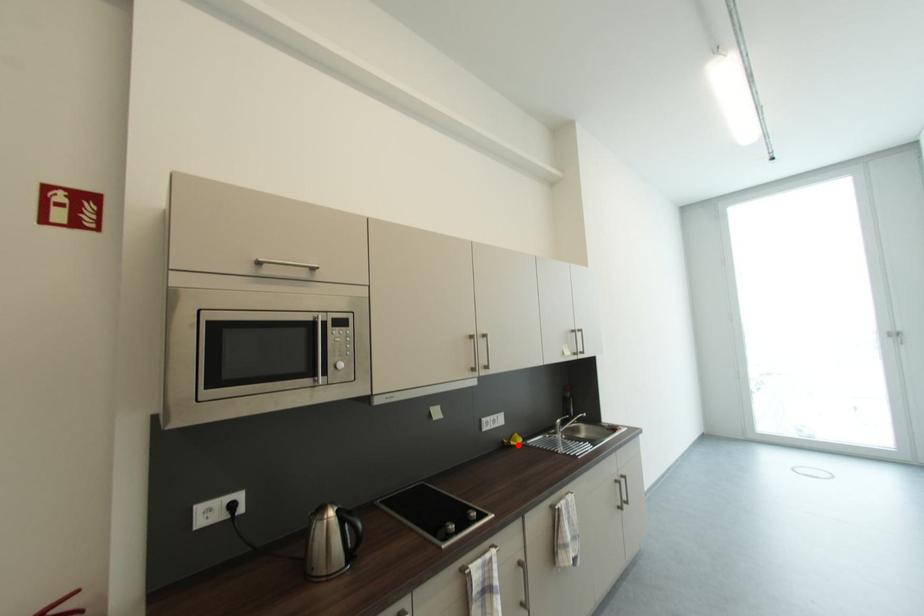
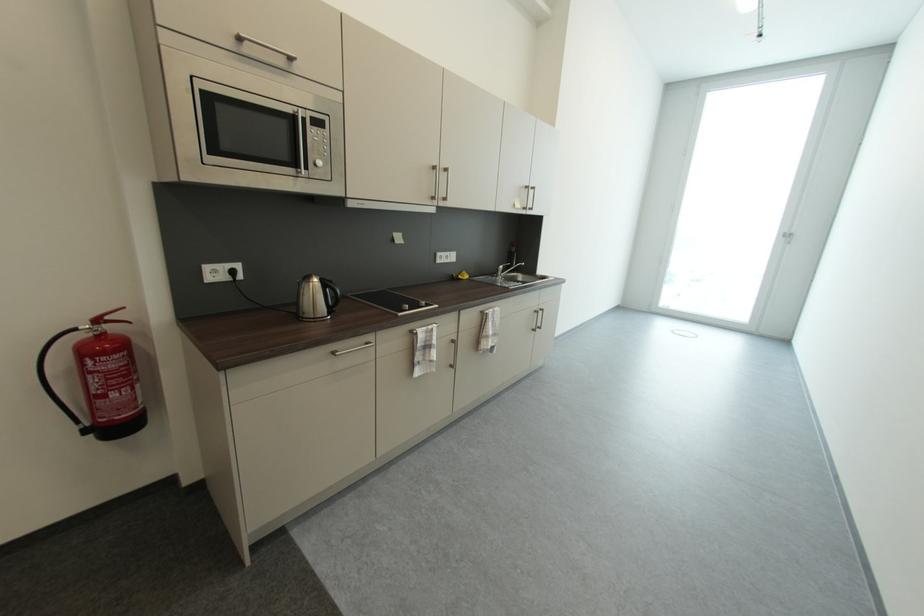
The point at the highlighted location is marked in the first image. Where is the corresponding point in the second image?

(467, 278)